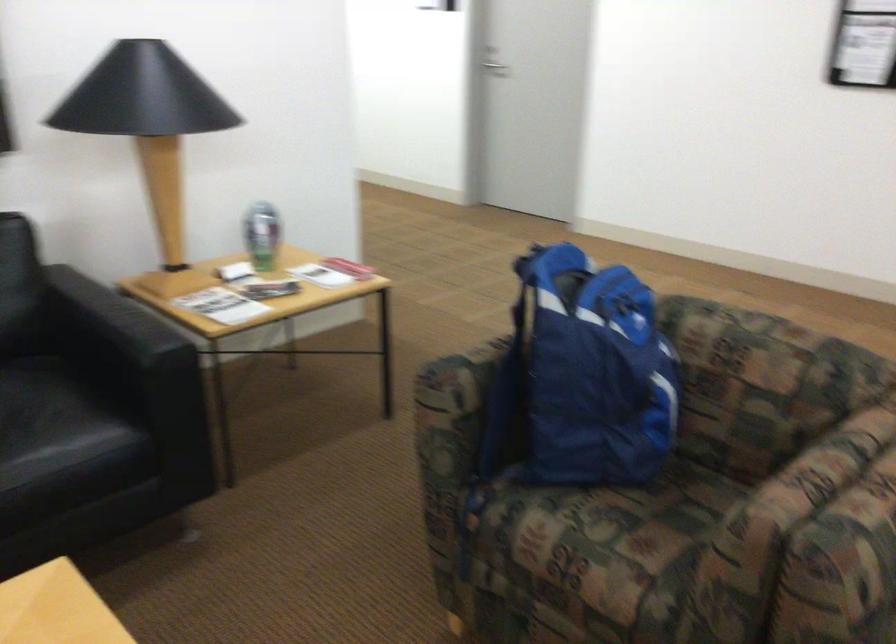
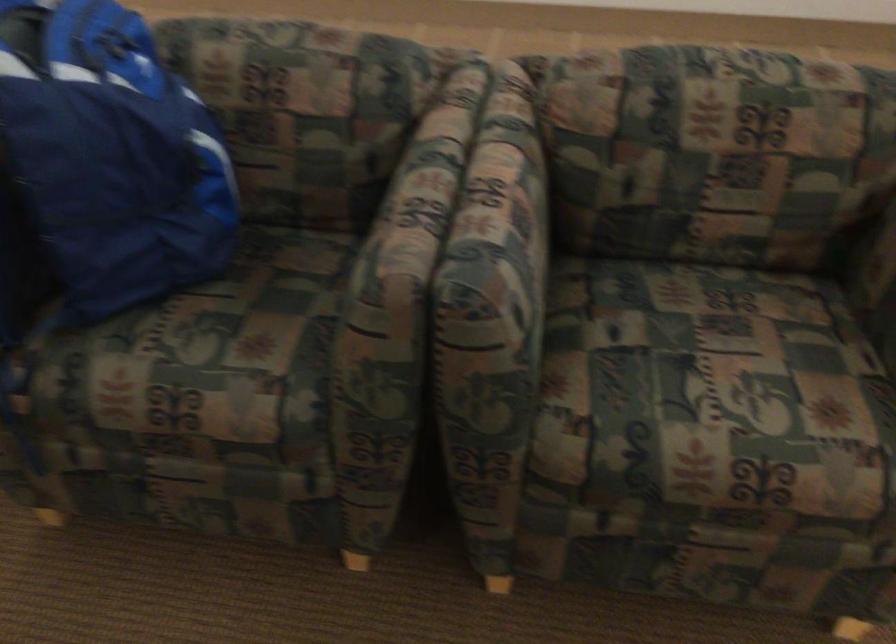
Based on the continuous images, in which direction is the camera rotating?

The camera rotated toward right-down.